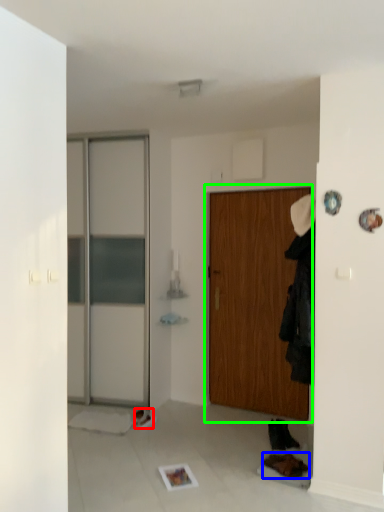
Question: Which object is positioned farthest from shoe (highlighted by a red box)? Select from shoe (highlighted by a blue box) and door (highlighted by a green box).

Choices:
 (A) shoe
 (B) door

Answer: (B)